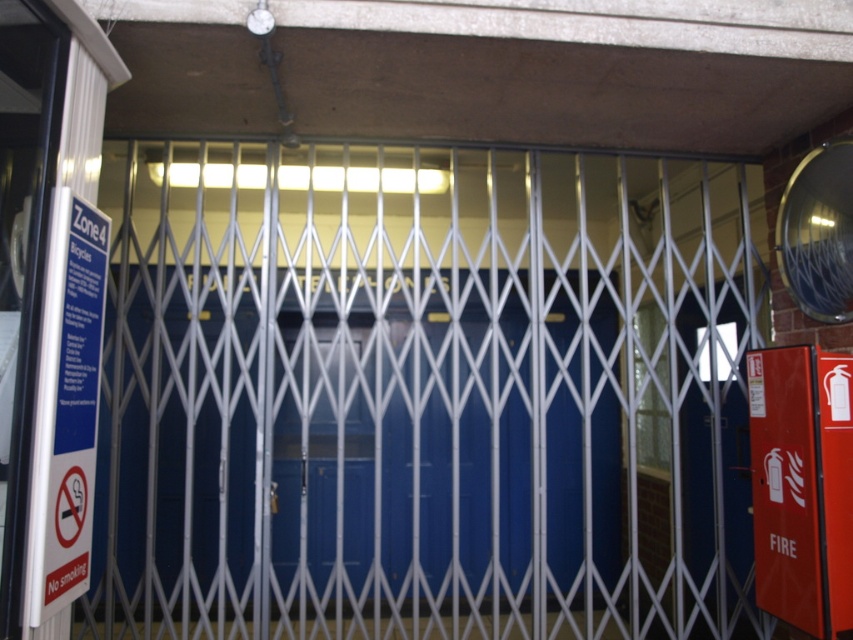
You are a maintenance worker needing to access the red matte fire extinguisher at right. The metallic blue elevator at center is blocking your path. Can you reach the fire extinguisher without moving the elevator?

The metallic blue elevator at center is above the red matte fire extinguisher at right, so you can access the fire extinguisher without moving the elevator since it is positioned below.

You are a maintenance worker needing to access the metallic blue elevator at center. There is a red matte fire extinguisher at right nearby. If you want to move the fire extinguisher to make space for the elevator maintenance, which object should you move and why?

You should move the red matte fire extinguisher at right because the metallic blue elevator at center is wider than the fire extinguisher, so moving the smaller fire extinguisher will create enough space for the elevator maintenance.